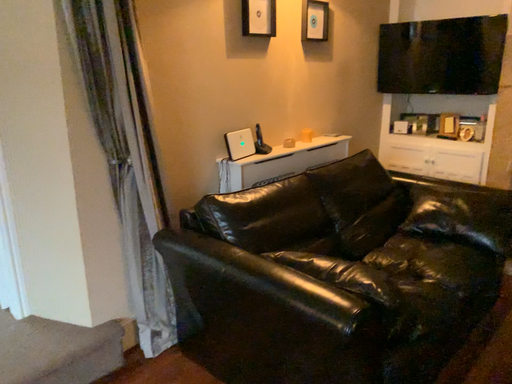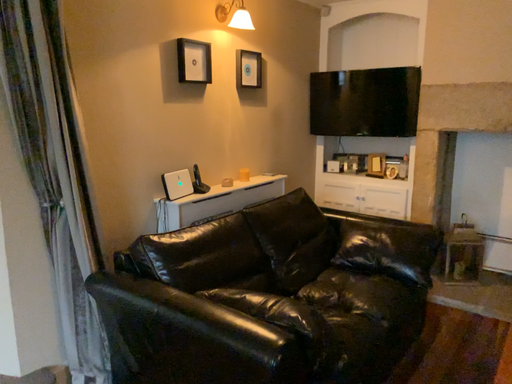
Question: Which way did the camera rotate in the video?

Choices:
 (A) rotated left
 (B) rotated right

Answer: (B)